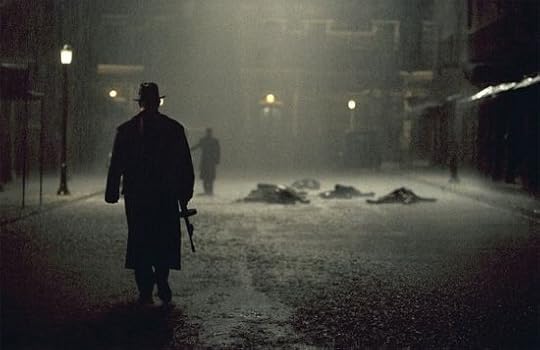
Image resolution: width=540 pixels, height=350 pixels. In order to click on lights in this screenshot , I will do `click(66, 55)`, `click(110, 90)`, `click(269, 96)`, `click(354, 98)`.